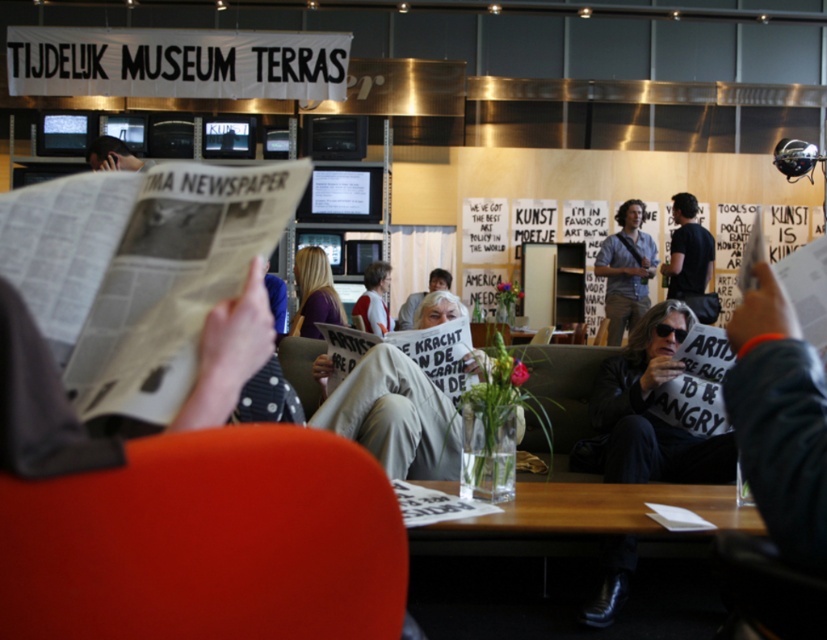
You are an event organizer planning to hang two shirts for a display. The black cotton shirt at center and the matte white shirt at center are both in the center. Which shirt should you choose if you want the taller one to be placed higher on the display rack?

The black cotton shirt at center has a greater height compared to the matte white shirt at center, so you should choose the black cotton shirt at center to place higher on the display rack.

You are standing in the exhibition area and see the black cotton shirt at center and the white paper banner at center. Which object is positioned higher in the scene?

The black cotton shirt at center is above the white paper banner at center, so it is positioned higher in the scene.